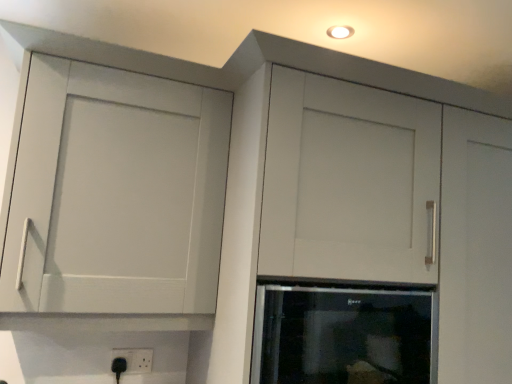
Question: Is matte white cupboard at upper left completely or partially inside black glass oven at center?

Choices:
 (A) no
 (B) yes

Answer: (A)

Question: Can you confirm if black glass oven at center is wider than matte white cupboard at upper left?

Choices:
 (A) no
 (B) yes

Answer: (A)

Question: Is black glass oven at center oriented towards matte white cupboard at upper left?

Choices:
 (A) yes
 (B) no

Answer: (B)

Question: Does black glass oven at center have a lesser width compared to matte white cupboard at upper left?

Choices:
 (A) yes
 (B) no

Answer: (A)

Question: From a real-world perspective, does black glass oven at center sit lower than matte white cupboard at upper left?

Choices:
 (A) yes
 (B) no

Answer: (A)

Question: Considering the positions of black glass oven at center and black plastic electric outlet at lower center in the image, is black glass oven at center taller or shorter than black plastic electric outlet at lower center?

Choices:
 (A) short
 (B) tall

Answer: (B)

Question: Is black glass oven at center wider or thinner than black plastic electric outlet at lower center?

Choices:
 (A) thin
 (B) wide

Answer: (B)

Question: Is black glass oven at center spatially inside black plastic electric outlet at lower center, or outside of it?

Choices:
 (A) inside
 (B) outside

Answer: (B)

Question: Considering the positions of point (348, 342) and point (124, 370), is point (348, 342) closer or farther from the camera than point (124, 370)?

Choices:
 (A) closer
 (B) farther

Answer: (A)

Question: From a real-world perspective, is matte white cupboard at upper left positioned above or below black glass oven at center?

Choices:
 (A) above
 (B) below

Answer: (A)

Question: In terms of height, does matte white cupboard at upper left look taller or shorter compared to black glass oven at center?

Choices:
 (A) tall
 (B) short

Answer: (A)

Question: Considering the relative positions of matte white cupboard at upper left and black glass oven at center in the image provided, is matte white cupboard at upper left to the left or to the right of black glass oven at center?

Choices:
 (A) left
 (B) right

Answer: (A)

Question: Considering the positions of point (106, 238) and point (317, 365), is point (106, 238) closer or farther from the camera than point (317, 365)?

Choices:
 (A) closer
 (B) farther

Answer: (B)

Question: In the image, is black plastic electric outlet at lower center on the left side or the right side of black glass oven at center?

Choices:
 (A) right
 (B) left

Answer: (B)

Question: From the image's perspective, is black plastic electric outlet at lower center positioned above or below black glass oven at center?

Choices:
 (A) below
 (B) above

Answer: (A)